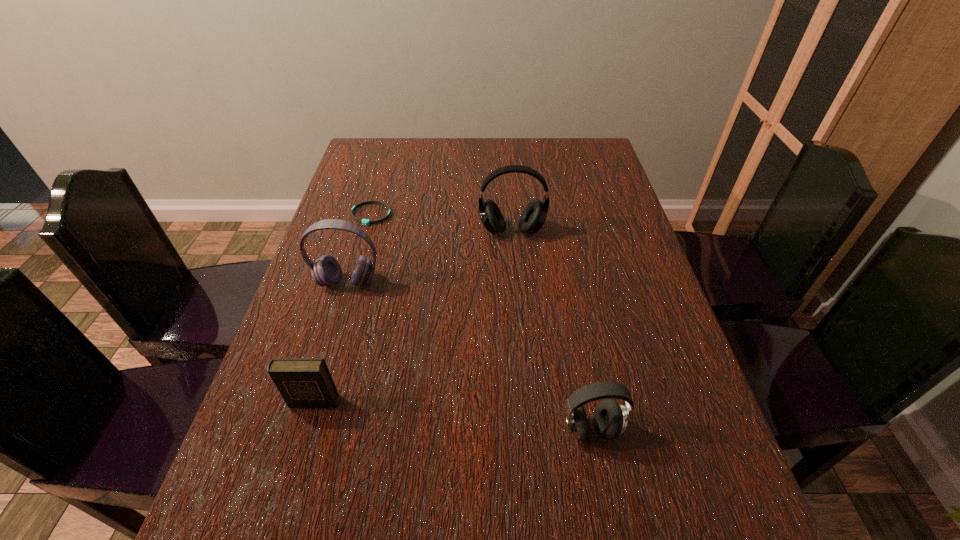
Where is `vacant space at the far right corner of the desktop`? Image resolution: width=960 pixels, height=540 pixels. vacant space at the far right corner of the desktop is located at coordinates (580, 157).

I want to click on unoccupied position between the second farthest headset and the wristband, so click(360, 249).

Identify the location of free space between the wristband and the nearest object. The height and width of the screenshot is (540, 960). (481, 322).

This screenshot has height=540, width=960. In order to click on vacant area that lies between the third nearest object and the shortest object in this screenshot , I will do `click(360, 249)`.

Find the location of a particular element. The width and height of the screenshot is (960, 540). free space between the diary and the leftmost headset is located at coordinates (330, 342).

Locate an element on the screen. The height and width of the screenshot is (540, 960). free space between the farthest headset and the diary is located at coordinates (413, 316).

Locate an element on the screen. unoccupied area between the nearest object and the wristband is located at coordinates (481, 322).

Find the location of a particular element. This screenshot has width=960, height=540. free spot between the diary and the shortest object is located at coordinates (342, 308).

Where is `free space between the nearest headset and the diary`? The image size is (960, 540). free space between the nearest headset and the diary is located at coordinates 452,416.

Find the location of a particular element. free spot between the farthest headset and the second farthest headset is located at coordinates (430, 256).